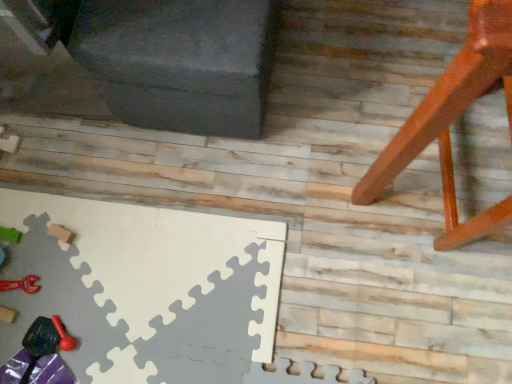
Question: Is point (22, 286) closer or farther from the camera than point (485, 4)?

Choices:
 (A) farther
 (B) closer

Answer: (A)

Question: From a real-world perspective, is metallic red wrench at lower left positioned above or below matte orange wood chair at right?

Choices:
 (A) above
 (B) below

Answer: (B)

Question: From the image's perspective, is metallic red wrench at lower left positioned above or below matte orange wood chair at right?

Choices:
 (A) above
 (B) below

Answer: (B)

Question: From their relative heights in the image, would you say matte orange wood chair at right is taller or shorter than metallic red wrench at lower left?

Choices:
 (A) tall
 (B) short

Answer: (A)

Question: Considering the positions of matte orange wood chair at right and metallic red wrench at lower left in the image, is matte orange wood chair at right wider or thinner than metallic red wrench at lower left?

Choices:
 (A) thin
 (B) wide

Answer: (B)

Question: Looking at the image, does matte orange wood chair at right seem bigger or smaller compared to metallic red wrench at lower left?

Choices:
 (A) small
 (B) big

Answer: (B)

Question: Is point (456, 71) positioned closer to the camera than point (2, 288)?

Choices:
 (A) farther
 (B) closer

Answer: (B)